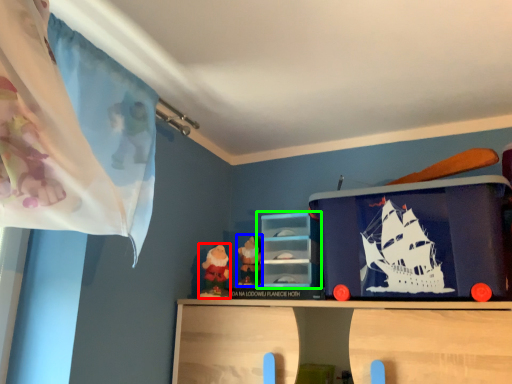
Question: Which object is positioned farthest from toy (highlighted by a red box)? Select from toy (highlighted by a blue box) and shelf (highlighted by a green box).

Choices:
 (A) toy
 (B) shelf

Answer: (B)